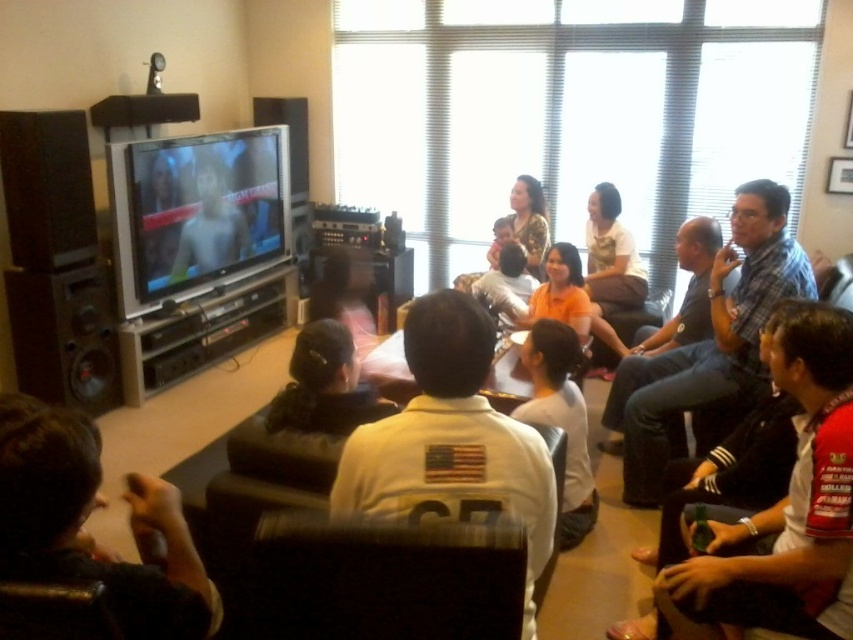
You are a photographer standing in the living room and want to take a picture of the white matte shirt at center and the shiny silver television at center left. To ensure both are in focus, you need to know their positions relative to each other. Which object is closer to you?

The shiny silver television at center left is closer to you than the white matte shirt at center, which is behind it.

You are sitting on the dark brown leather chair at lower left and want to reach the shiny silver television at center left. Which direction should you move to get closer to the television?

Since the dark brown leather chair at lower left is to the right of the shiny silver television at center left, you should move to your left to get closer to the television.